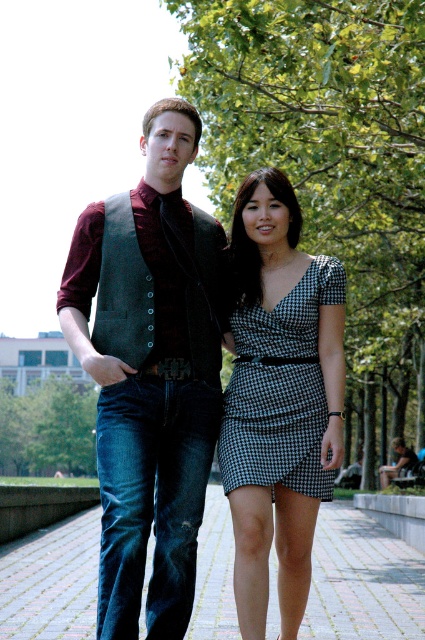
Between velvet vest at center and brick pavement at lower center, which one is positioned lower?

Positioned lower is brick pavement at lower center.

Between velvet vest at center and brick pavement at lower center, which one has less height?

With less height is brick pavement at lower center.

Is point (118, 541) in front of point (187, 627)?

That is True.

In order to click on velvet vest at center in this screenshot , I will do tap(150, 372).

Can you confirm if velvet vest at center is bigger than black houndstooth dress at center?

Yes.

Based on the photo, who is more forward, (65, 269) or (280, 410)?

Point (280, 410)

Who is more forward, (107, 372) or (261, 342)?

Point (107, 372) is in front.

Locate an element on the screen. velvet vest at center is located at coordinates (150, 372).

Which is in front, point (261, 358) or point (206, 636)?

Point (261, 358) is more forward.

Does houndstooth fabric dress at center appear under brick pavement at lower center?

Actually, houndstooth fabric dress at center is above brick pavement at lower center.

Which is in front, point (235, 440) or point (320, 595)?

Point (235, 440)

This screenshot has width=425, height=640. Find the location of `houndstooth fabric dress at center`. houndstooth fabric dress at center is located at coordinates (280, 400).